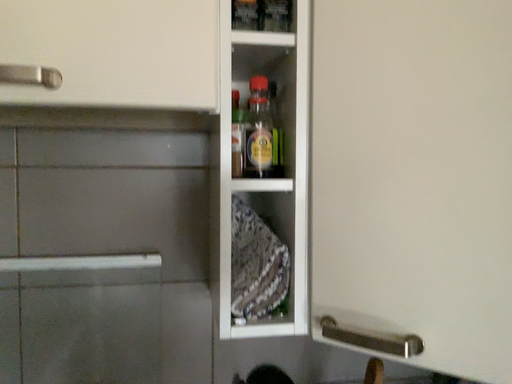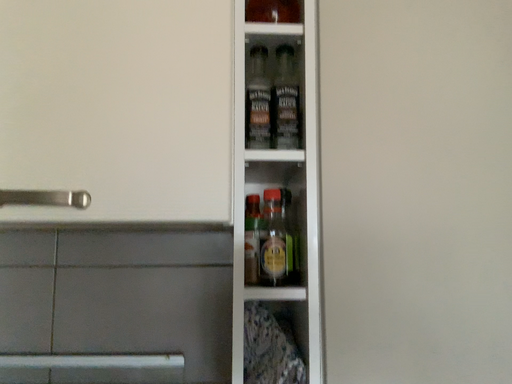
Question: Which way did the camera rotate in the video?

Choices:
 (A) rotated upward
 (B) rotated downward

Answer: (A)